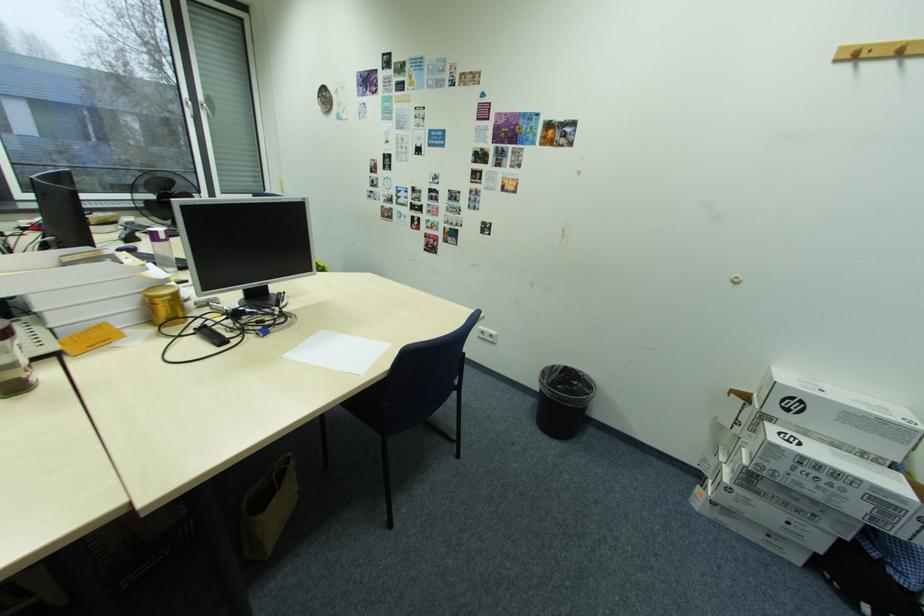
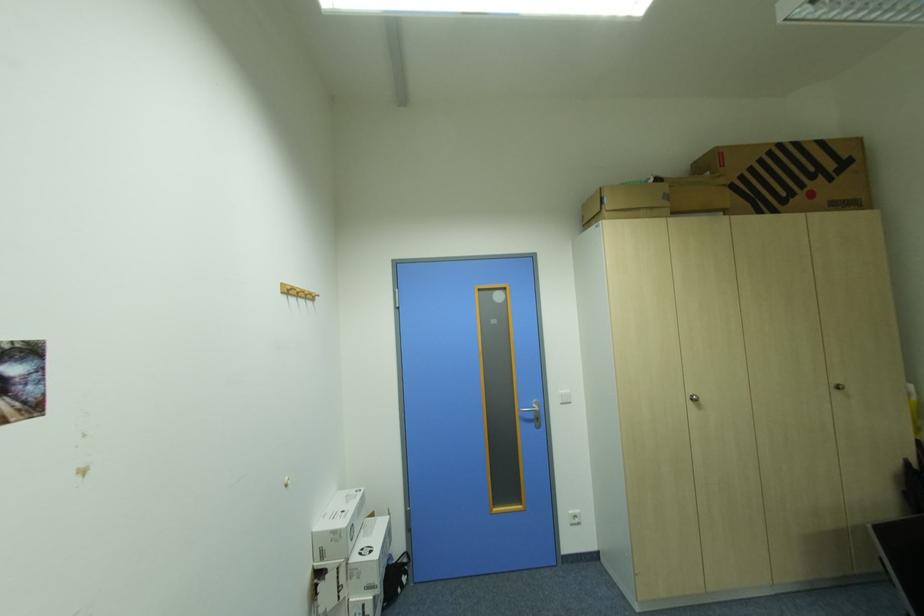
Where in the second image is the point corresponding to point (779, 379) from the first image?

(341, 533)